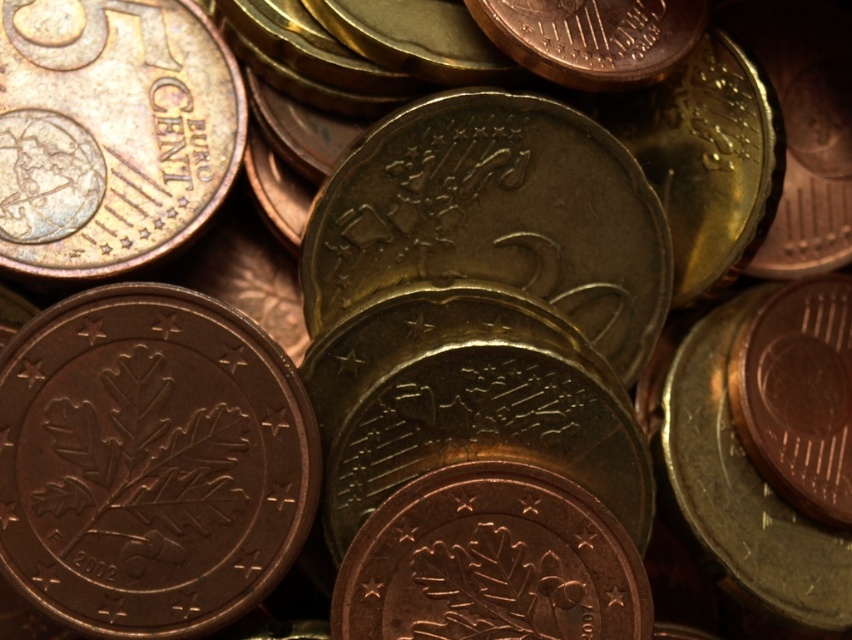
Measure the distance between point (187, 397) and camera.

Point (187, 397) and camera are 3.87 feet apart from each other.

Is the position of bronze metallic coin at lower left less distant than that of brass metallic coin at upper left?

Yes, it is in front of brass metallic coin at upper left.

Looking at this image, who is more distant from viewer, (125, 609) or (78, 93)?

The point (78, 93) is behind.

Find the location of a particular element. This screenshot has height=640, width=852. bronze metallic coin at lower left is located at coordinates (150, 461).